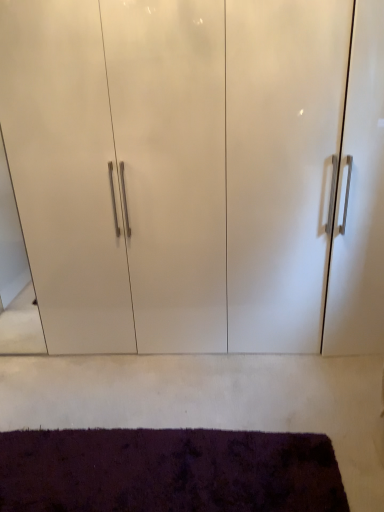
Question: Considering the relative sizes of dark purple shaggy rug at lower center and white glossy cabinet at center in the image provided, is dark purple shaggy rug at lower center taller than white glossy cabinet at center?

Choices:
 (A) yes
 (B) no

Answer: (B)

Question: Does dark purple shaggy rug at lower center have a smaller size compared to white glossy cabinet at center?

Choices:
 (A) no
 (B) yes

Answer: (B)

Question: Can white glossy cabinet at center be found inside dark purple shaggy rug at lower center?

Choices:
 (A) yes
 (B) no

Answer: (B)

Question: From the image's perspective, does dark purple shaggy rug at lower center appear higher than white glossy cabinet at center?

Choices:
 (A) yes
 (B) no

Answer: (B)

Question: Is dark purple shaggy rug at lower center bigger than white glossy cabinet at center?

Choices:
 (A) no
 (B) yes

Answer: (A)

Question: Is dark purple shaggy rug at lower center facing towards white glossy cabinet at center?

Choices:
 (A) yes
 (B) no

Answer: (B)

Question: Is white glossy cabinet at center with dark purple shaggy rug at lower center?

Choices:
 (A) yes
 (B) no

Answer: (B)

Question: From a real-world perspective, is white glossy cabinet at center positioned over dark purple shaggy rug at lower center based on gravity?

Choices:
 (A) no
 (B) yes

Answer: (B)

Question: Does white glossy cabinet at center have a greater width compared to dark purple shaggy rug at lower center?

Choices:
 (A) yes
 (B) no

Answer: (A)

Question: Is white glossy cabinet at center smaller than dark purple shaggy rug at lower center?

Choices:
 (A) no
 (B) yes

Answer: (A)

Question: Is white glossy cabinet at center looking in the opposite direction of dark purple shaggy rug at lower center?

Choices:
 (A) no
 (B) yes

Answer: (A)

Question: Is white glossy cabinet at center to the right of dark purple shaggy rug at lower center from the viewer's perspective?

Choices:
 (A) yes
 (B) no

Answer: (A)

Question: Choose the correct answer: Is dark purple shaggy rug at lower center inside white glossy cabinet at center or outside it?

Choices:
 (A) inside
 (B) outside

Answer: (B)